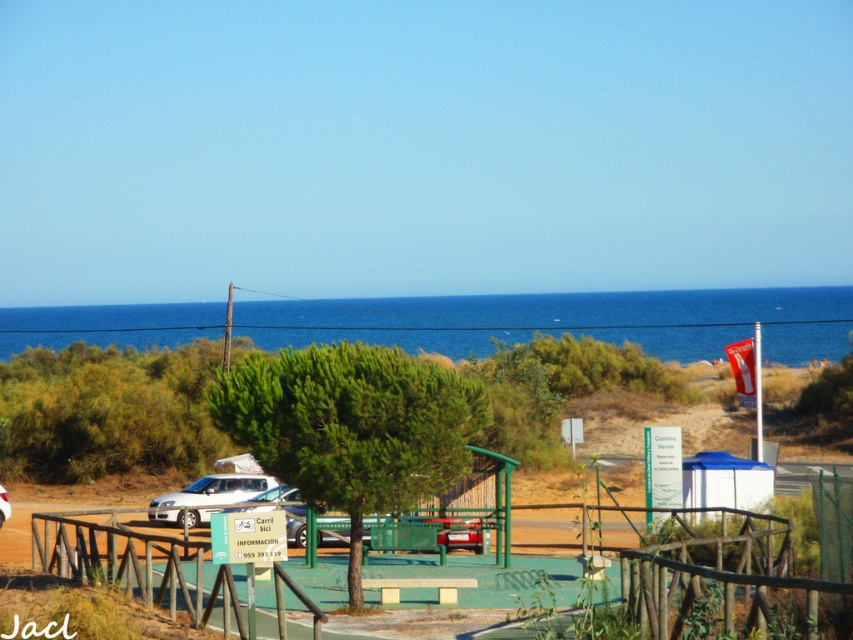
Question: Which point is farther to the camera?

Choices:
 (A) white matte car at center
 (B) blue water at center
 (C) white matte car at lower left

Answer: (B)

Question: Where is white matte car at lower left located in relation to white matte car at center in the image?

Choices:
 (A) left
 (B) right

Answer: (B)

Question: Which object appears farthest from the camera in this image?

Choices:
 (A) white matte car at lower left
 (B) green metal bench at center

Answer: (A)

Question: Is blue water at center thinner than white matte car at center?

Choices:
 (A) no
 (B) yes

Answer: (A)

Question: Which object is farther from the camera taking this photo?

Choices:
 (A) green metal bench at center
 (B) blue water at center
 (C) white matte car at lower left
 (D) white matte car at center

Answer: (B)

Question: Does blue water at center appear on the left side of white matte car at lower left?

Choices:
 (A) yes
 (B) no

Answer: (A)